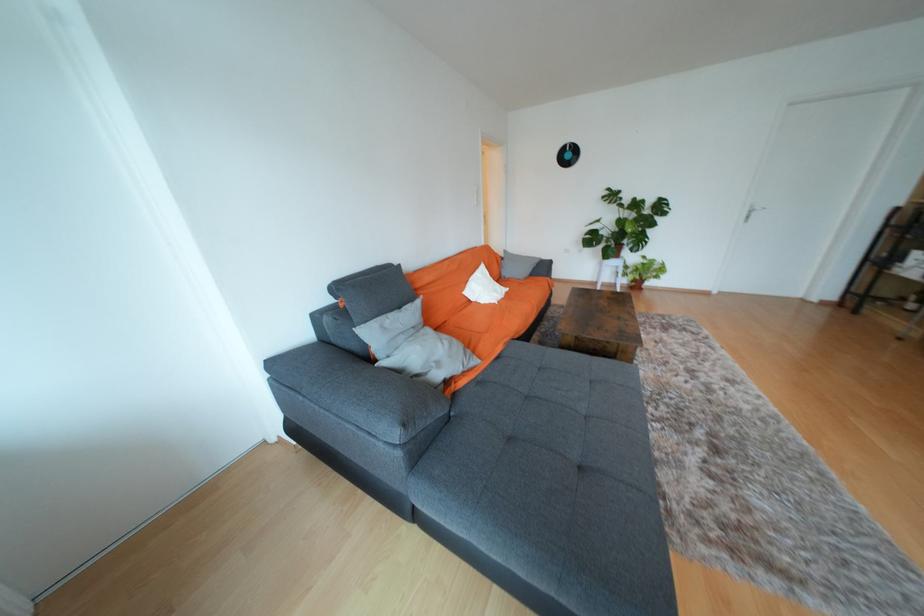
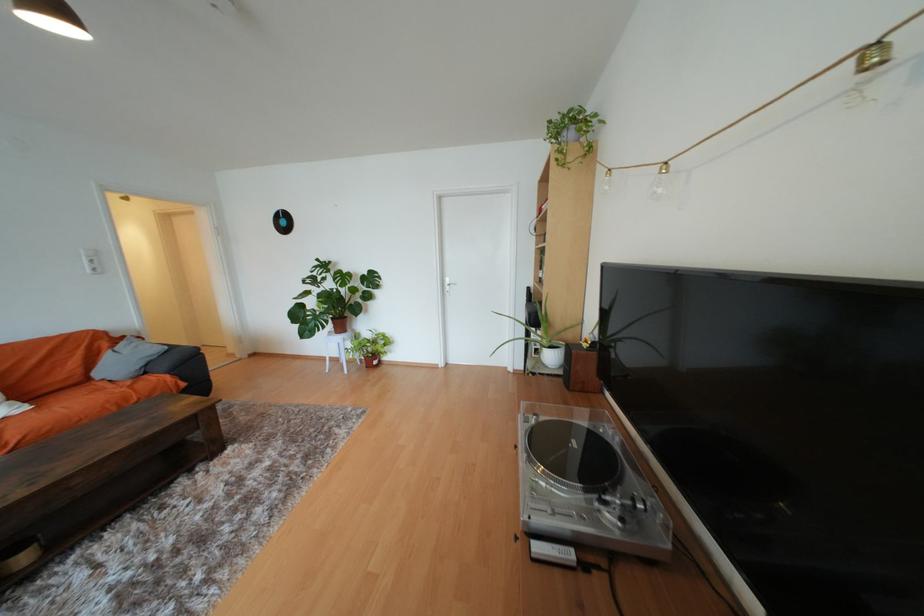
Find the pixel in the second image that matches (669,265) in the first image.

(391, 339)